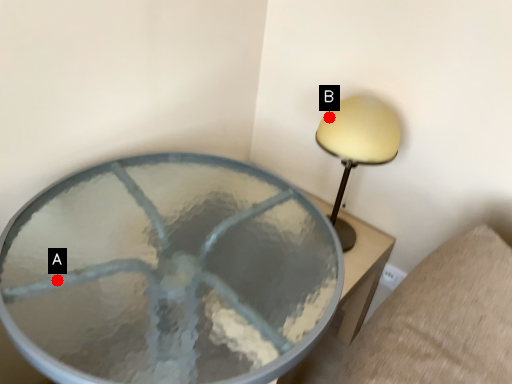
Question: Two points are circled on the image, labeled by A and B beside each circle. Which point is closer to the camera?

Choices:
 (A) A is closer
 (B) B is closer

Answer: (A)